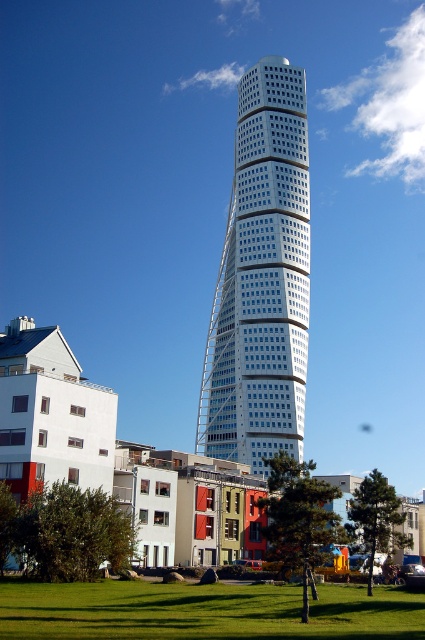
You are standing at the base of the white glass skyscraper at center and want to take a photo of it from a distance. If you walk 30 meters away from the building, will you be able to capture the entire structure in your camera frame?

The white glass skyscraper at center is currently 90.04 meters away from the camera. If you walk 30 meters further away, the total distance becomes 120.04 meters. At this distance, it might be challenging to capture the entire skyscraper in one frame due to the reduced field of view, so you might need to adjust your position or use a wide angle lens.

You are standing in the park area and want to take a photo of the white glass skyscraper at center. To frame the shot properly, you need to position yourself so that the green grass at lower center is on your left side. Based on the scene, is this possible? Explain your reasoning.

Yes, it is possible. Since the white glass skyscraper at center is to the right of the green grass at lower center, positioning yourself so that the green grass at lower center is on your left would naturally place the skyscraper on your right side, aligning with their relative positions.

You are a drone operator planning to fly a drone from the green grass at lower center to the white glass skyscraper at center. The drone has a maximum flight range of 60 meters. Will it be able to reach the skyscraper?

The distance between the white glass skyscraper at center and the green grass at lower center is 62.78 meters, which exceeds the drone operator maximum flight range of 60 meters. The drone will not be able to reach the skyscraper.